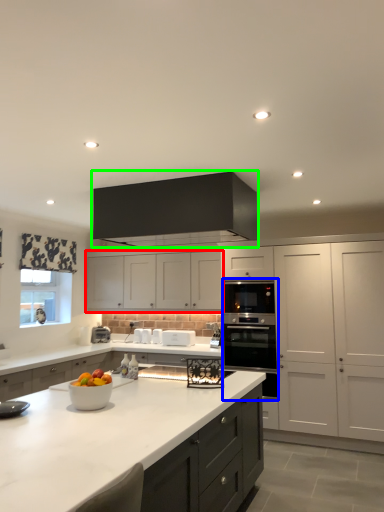
Question: Estimate the real-world distances between objects in this image. Which object is farther from cabinetry (highlighted by a red box), oven (highlighted by a blue box) or cabinetry (highlighted by a green box)?

Choices:
 (A) oven
 (B) cabinetry

Answer: (B)